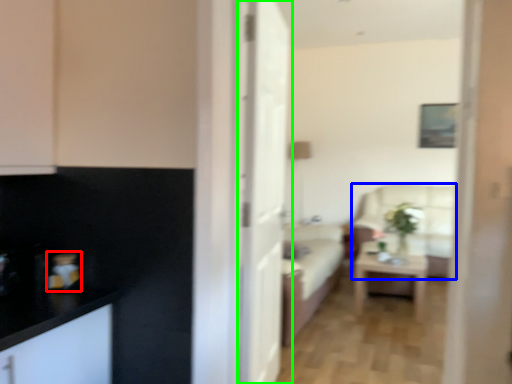
Question: Which object is the closest to the appliance (highlighted by a red box)? Choose among these: armchair (highlighted by a blue box) or door (highlighted by a green box).

Choices:
 (A) armchair
 (B) door

Answer: (B)